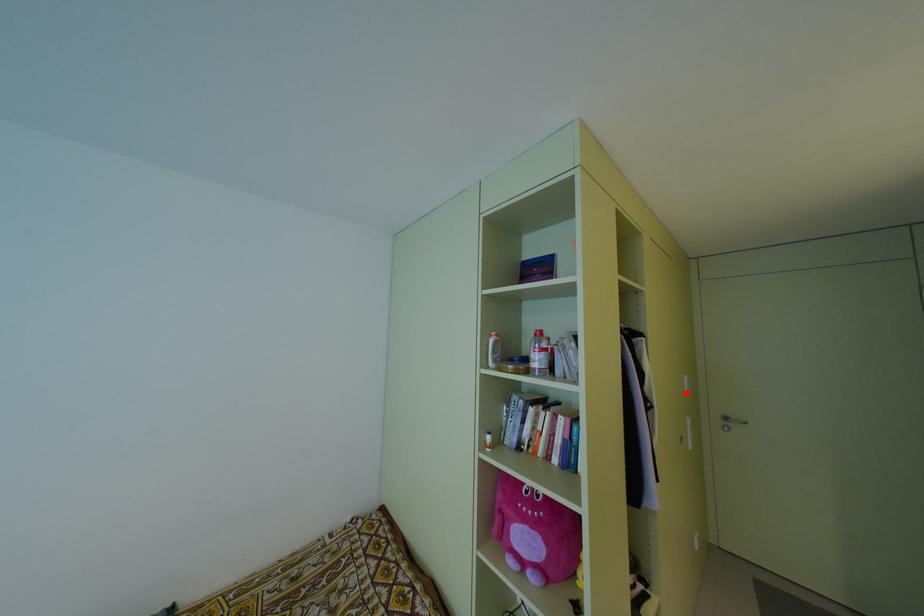
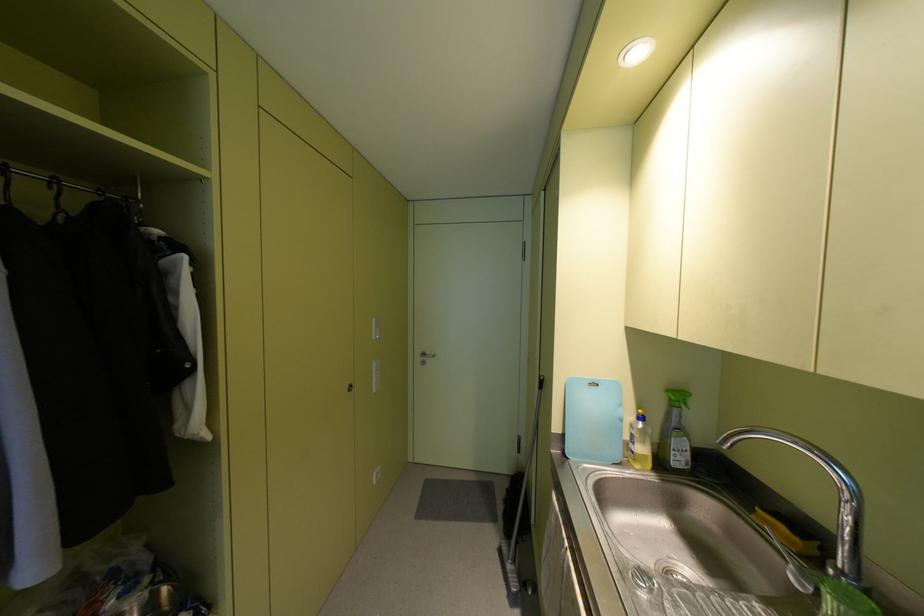
Where in the second image is the point corresponding to the highlighted location from the first image?

(373, 336)